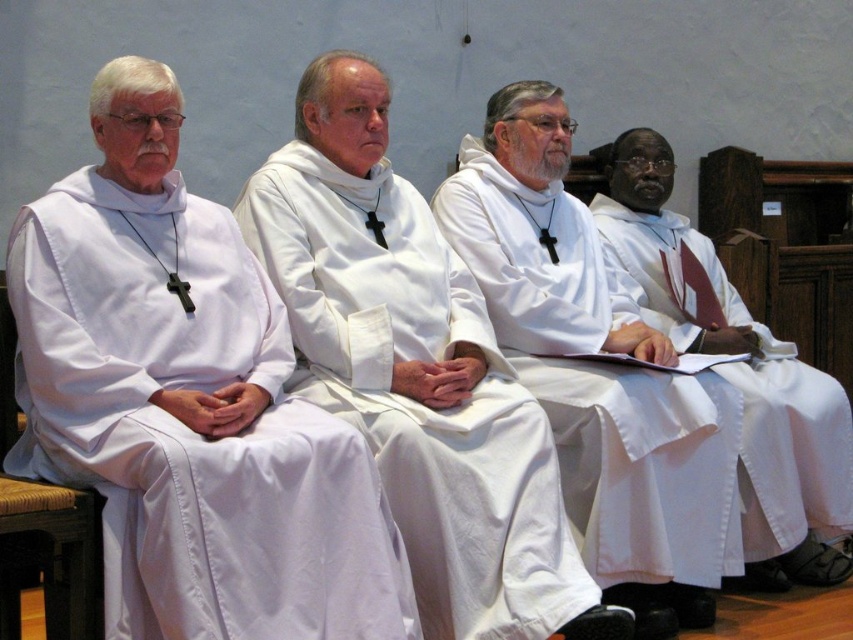
Where is `white matte robe at left`? The height and width of the screenshot is (640, 853). white matte robe at left is located at coordinates (187, 403).

The width and height of the screenshot is (853, 640). In order to click on white matte robe at left in this screenshot , I will do `click(187, 403)`.

Locate an element on the screen. The height and width of the screenshot is (640, 853). white matte robe at left is located at coordinates (187, 403).

Is white matte/soft cloth robe at center shorter than white matte robe at center?

Indeed, white matte/soft cloth robe at center has a lesser height compared to white matte robe at center.

Who is lower down, white matte/soft cloth robe at center or white matte robe at center?

white matte/soft cloth robe at center is lower down.

Who is more distant from viewer, (561, 560) or (477, 166)?

The point (477, 166) is behind.

What are the coordinates of `white matte/soft cloth robe at center` in the screenshot? It's located at (418, 400).

Is point (107, 604) positioned after point (584, 228)?

No, it is in front of (584, 228).

Can you confirm if white matte robe at left is smaller than white matte robe at center?

Correct, white matte robe at left occupies less space than white matte robe at center.

Where is `white matte robe at left`? Image resolution: width=853 pixels, height=640 pixels. white matte robe at left is located at coordinates (187, 403).